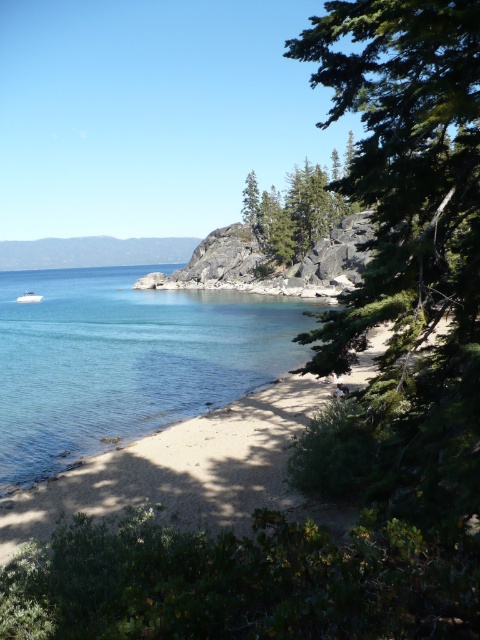
Question: Can you confirm if green textured rock at center is wider than white glossy boat at lower left?

Choices:
 (A) yes
 (B) no

Answer: (A)

Question: Estimate the real-world distances between objects in this image. Which object is closer to the clear water at lower left?

Choices:
 (A) green textured rock at center
 (B) white glossy boat at lower left

Answer: (B)

Question: Among these points, which one is farthest from the camera?

Choices:
 (A) (113, 380)
 (B) (317, 189)

Answer: (B)

Question: In this image, where is clear water at lower left located relative to white glossy boat at lower left?

Choices:
 (A) left
 (B) right

Answer: (B)

Question: Which of these objects is positioned farthest from the white glossy boat at lower left?

Choices:
 (A) clear water at lower left
 (B) green textured rock at center

Answer: (B)

Question: Does green textured rock at center come behind white glossy boat at lower left?

Choices:
 (A) yes
 (B) no

Answer: (B)